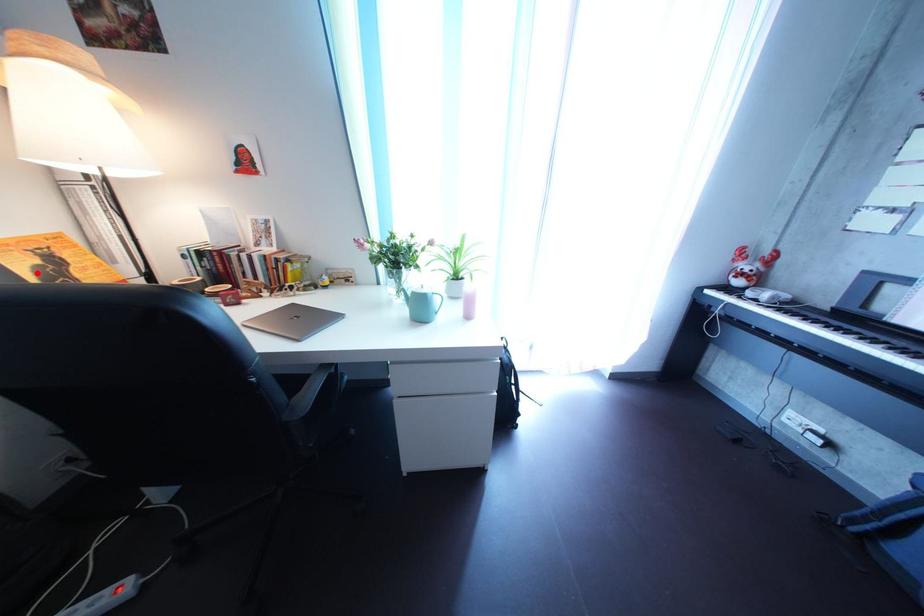
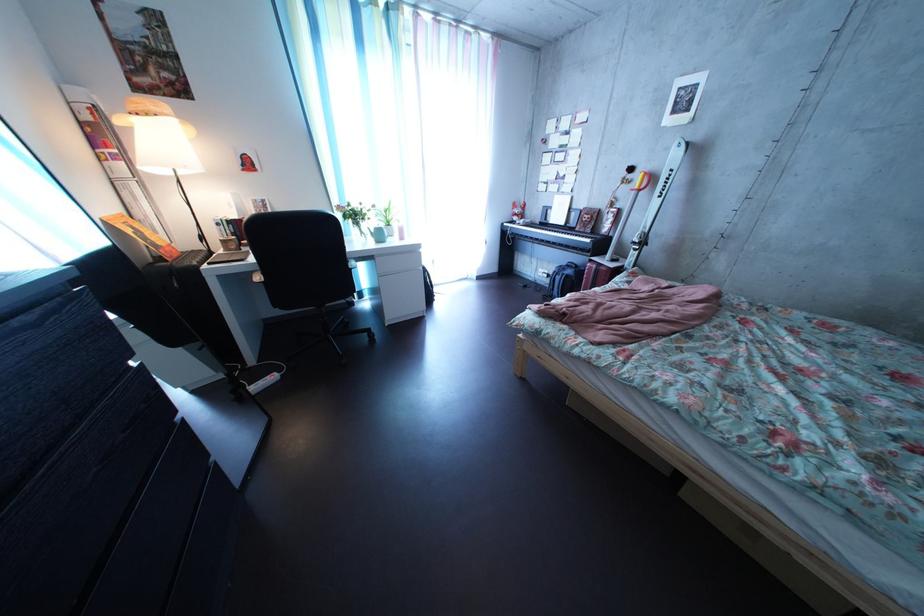
Locate, in the second image, the point that corresponds to the highlighted location in the first image.

(142, 238)